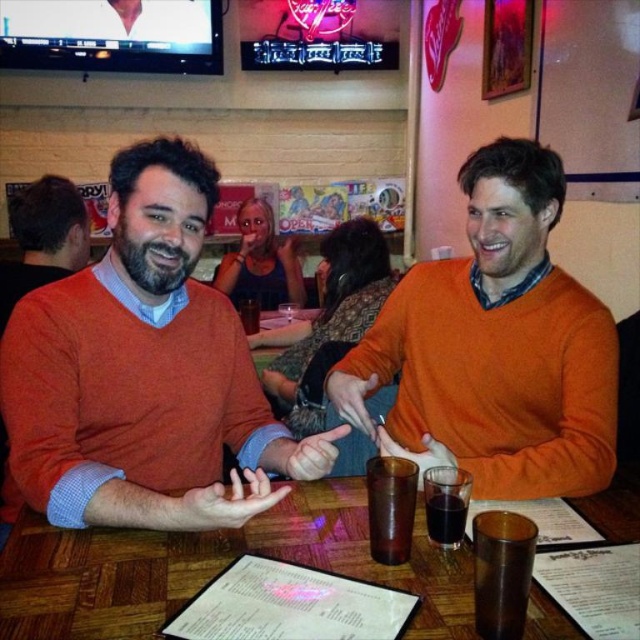
Image resolution: width=640 pixels, height=640 pixels. Describe the element at coordinates (212, 568) in the screenshot. I see `wooden table at center` at that location.

Is point (81, 582) behind point (244, 300)?

No, it is not.

Measure the distance between point (x=440, y=557) and camera.

93.37 centimeters

Locate an element on the screen. The image size is (640, 640). wooden table at center is located at coordinates (212, 568).

Where is `matte orange sweater at left`? matte orange sweater at left is located at coordinates (141, 372).

In the scene shown: Is matte orange sweater at left thinner than dark brown liquid at table center?

In fact, matte orange sweater at left might be wider than dark brown liquid at table center.

Does point (97, 323) lie behind point (460, 541)?

Yes, it is.

Image resolution: width=640 pixels, height=640 pixels. Identify the location of matte orange sweater at left. (141, 372).

Which is more to the right, matte orange sweater at left or wooden table at center?

From the viewer's perspective, wooden table at center appears more on the right side.

Which is above, matte orange sweater at left or wooden table at center?

matte orange sweater at left

Image resolution: width=640 pixels, height=640 pixels. Identify the location of matte orange sweater at left. (141, 372).

At what (x,y) coordinates should I click in order to perform the action: click on matte orange sweater at left. Please return your answer as a coordinate pair (x, y). Looking at the image, I should click on (141, 372).